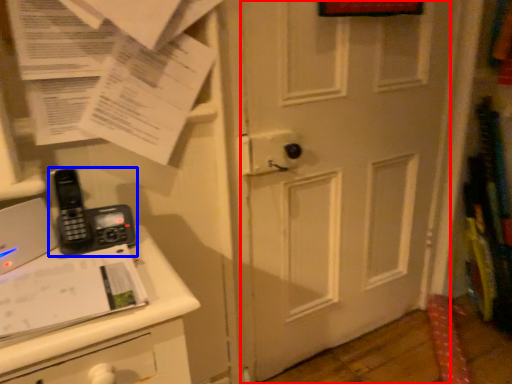
Question: Which object appears closest to the camera in this image, door (highlighted by a red box) or corded phone (highlighted by a blue box)?

Choices:
 (A) door
 (B) corded phone

Answer: (B)